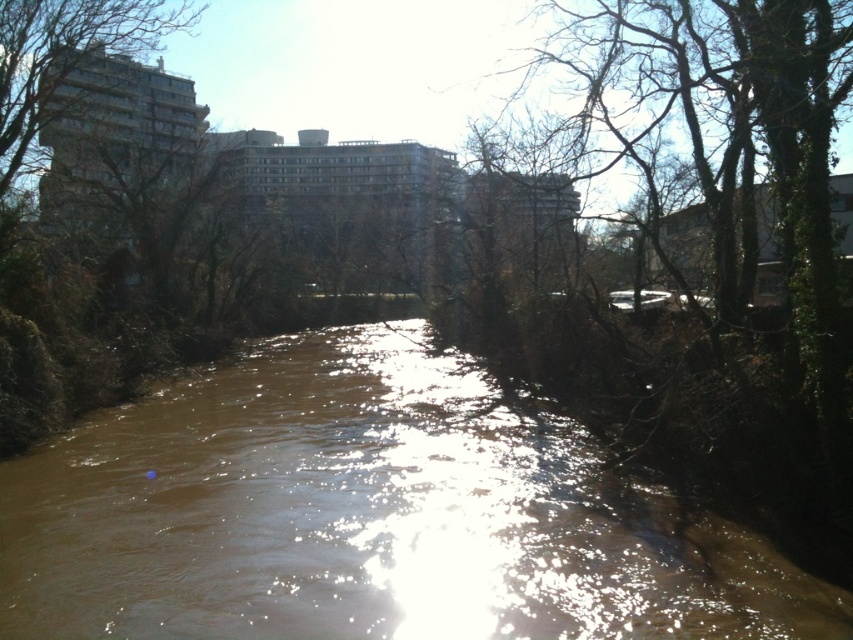
Question: Is brown muddy water at center behind green leafy tree at upper left?

Choices:
 (A) yes
 (B) no

Answer: (B)

Question: Can you confirm if brown muddy water at center is positioned below green leafy tree at upper left?

Choices:
 (A) no
 (B) yes

Answer: (B)

Question: Which point is farther to the camera?

Choices:
 (A) brown muddy water at center
 (B) green leafy tree at upper left

Answer: (B)

Question: Which point is farther from the camera taking this photo?

Choices:
 (A) (165, 426)
 (B) (4, 157)

Answer: (B)

Question: Does brown muddy water at center have a greater width compared to green leafy tree at upper left?

Choices:
 (A) no
 (B) yes

Answer: (B)